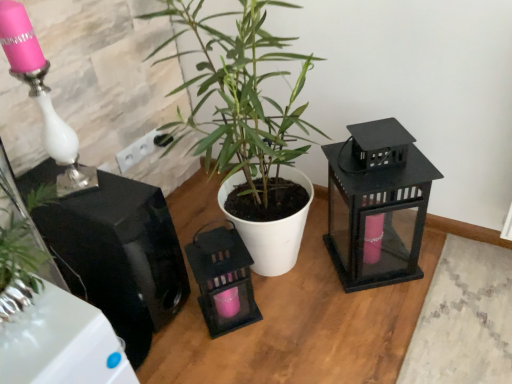
Find the location of a particular element. This screenshot has height=384, width=512. vacant area that is situated to the right of matte black lantern at right, acting as the 2th appliance starting from the left is located at coordinates click(442, 259).